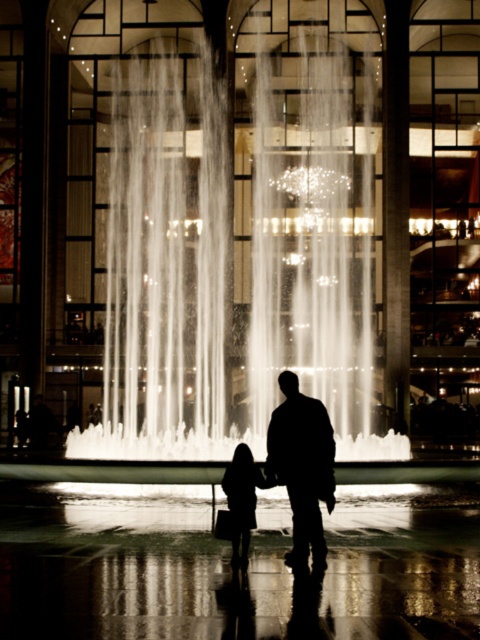
You are a photographer planning to take a photo of the silhouette fabric at center and the silhouette dress at center in the fountain area. Based on their sizes, which object should you focus on first to ensure it is in frame?

The silhouette fabric at center is much taller than the silhouette dress at center, so you should focus on the silhouette fabric at center first to ensure it is in frame.

You are an event planner organizing a photoshoot in this venue. You want to position two models wearing the silhouette fabric at center and the silhouette dress at center so that both are visible in the frame. Given their sizes, which object should be placed closer to the camera to ensure both are fully visible?

The silhouette fabric at center is bigger than the silhouette dress at center. To ensure both are fully visible in the frame, the silhouette dress at center should be placed closer to the camera since it is smaller, allowing the larger silhouette fabric at center to be positioned further back without being cropped out.